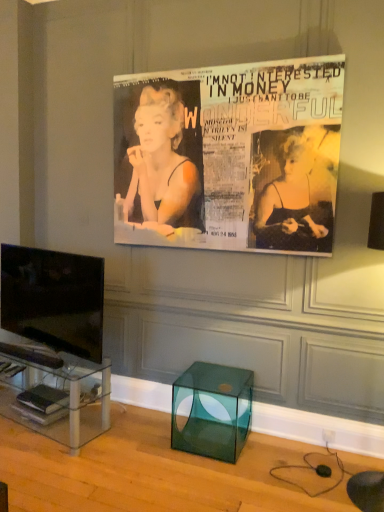
What do you see at coordinates (40, 413) in the screenshot? This screenshot has width=384, height=512. I see `hardcover book at lower left, arranged as the 3th magazine when viewed from the top` at bounding box center [40, 413].

Locate an element on the screen. The width and height of the screenshot is (384, 512). transparent glass cube at lower center is located at coordinates (212, 410).

What do you see at coordinates (59, 389) in the screenshot? I see `clear glass tv stand at lower left` at bounding box center [59, 389].

I want to click on black glossy tv at left, so click(54, 298).

There is a transparent glass cube at lower center. Identify the location of the 1st magazine below it (from the image's perspective). (44, 399).

Can you tell me how much transparent glass cube at lower center and matte black magazine at lower left, which ranks as the second magazine in top-to-bottom order, differ in facing direction?

The angular difference between transparent glass cube at lower center and matte black magazine at lower left, which ranks as the second magazine in top-to-bottom order, is 13.6 degrees.

Does transparent glass cube at lower center appear on the right side of matte black magazine at lower left, placed as the 2th magazine when sorted from bottom to top?

Yes.

Between point (187, 448) and point (45, 390), which one is positioned behind?

The point (45, 390) is farther.

Are transparent glass cube at lower center and hardcover book at lower left, arranged as the 3th magazine when viewed from the top, beside each other?

transparent glass cube at lower center is not next to hardcover book at lower left, arranged as the 3th magazine when viewed from the top, and they're not touching.

Who is taller, transparent glass cube at lower center or hardcover book at lower left, arranged as the 3th magazine when viewed from the top?

transparent glass cube at lower center.

Can you confirm if transparent glass cube at lower center is wider than hardcover book at lower left, arranged as the 3th magazine when viewed from the top?

Yes.

Is transparent glass cube at lower center facing towards hardcover book at lower left, arranged as the 3th magazine when viewed from the top?

No, transparent glass cube at lower center is not oriented towards hardcover book at lower left, arranged as the 3th magazine when viewed from the top.

Between hardcover book at lower left, arranged as the 3th magazine when viewed from the top, and black glossy tv at left, which one is positioned behind?

hardcover book at lower left, arranged as the 3th magazine when viewed from the top, is behind.

Looking at their sizes, would you say hardcover book at lower left, marked as the first magazine in a bottom-to-top arrangement, is wider or thinner than black glossy tv at left?

Considering their sizes, hardcover book at lower left, marked as the first magazine in a bottom-to-top arrangement, looks broader than black glossy tv at left.

Considering the positions of point (33, 414) and point (77, 291), is point (33, 414) closer or farther from the camera than point (77, 291)?

Point (33, 414) is farther from the camera than point (77, 291).

From the image's perspective, is hardcover book at lower left, arranged as the 3th magazine when viewed from the top, beneath black glossy tv at left?

Correct, hardcover book at lower left, arranged as the 3th magazine when viewed from the top, appears lower than black glossy tv at left in the image.

Is black glossy tv at left closer to the viewer compared to matte black magazine at lower left, placed as the 2th magazine when sorted from bottom to top?

Yes, it is in front of matte black magazine at lower left, placed as the 2th magazine when sorted from bottom to top.

The image size is (384, 512). What are the coordinates of `television located on the right of matte black magazine at lower left, which ranks as the second magazine in top-to-bottom order` in the screenshot? It's located at (54, 298).

Would you consider black glossy tv at left to be distant from matte black magazine at lower left, which ranks as the second magazine in top-to-bottom order?

black glossy tv at left is near matte black magazine at lower left, which ranks as the second magazine in top-to-bottom order, not far away.

Between black glossy tv at left and matte black magazine at lower left, which ranks as the second magazine in top-to-bottom order, which one has larger size?

With larger size is black glossy tv at left.

Is matte black poster at upper center at the back of matte black magazine at lower left, placed as the 2th magazine when sorted from bottom to top?

No, matte black poster at upper center is not at the back of matte black magazine at lower left, placed as the 2th magazine when sorted from bottom to top.

Considering the positions of objects matte black magazine at lower left, which ranks as the second magazine in top-to-bottom order, and matte black poster at upper center in the image provided, who is more to the left, matte black magazine at lower left, which ranks as the second magazine in top-to-bottom order, or matte black poster at upper center?

Positioned to the left is matte black magazine at lower left, which ranks as the second magazine in top-to-bottom order.

Which is correct: matte black magazine at lower left, placed as the 2th magazine when sorted from bottom to top, is inside matte black poster at upper center, or outside of it?

matte black magazine at lower left, placed as the 2th magazine when sorted from bottom to top, exists outside the volume of matte black poster at upper center.

Considering the relative sizes of clear glass tv stand at lower left and black glossy tv at left in the image provided, is clear glass tv stand at lower left wider than black glossy tv at left?

Yes, clear glass tv stand at lower left is wider than black glossy tv at left.

Is clear glass tv stand at lower left in front of black glossy tv at left?

That is False.

Is clear glass tv stand at lower left not close to black glossy tv at left?

clear glass tv stand at lower left is near black glossy tv at left, not far away.

From the image's perspective, relative to matte black poster at upper center, is hardcover book at lower left, marked as the first magazine in a bottom-to-top arrangement, above or below?

From the image's perspective, hardcover book at lower left, marked as the first magazine in a bottom-to-top arrangement, appears below matte black poster at upper center.

Looking at their sizes, would you say hardcover book at lower left, marked as the first magazine in a bottom-to-top arrangement, is wider or thinner than matte black poster at upper center?

hardcover book at lower left, marked as the first magazine in a bottom-to-top arrangement, is wider than matte black poster at upper center.

Is hardcover book at lower left, arranged as the 3th magazine when viewed from the top, to the left or to the right of matte black poster at upper center in the image?

hardcover book at lower left, arranged as the 3th magazine when viewed from the top, is to the left of matte black poster at upper center.

Considering the sizes of hardcover book at lower left, arranged as the 3th magazine when viewed from the top, and matte black poster at upper center in the image, is hardcover book at lower left, arranged as the 3th magazine when viewed from the top, taller or shorter than matte black poster at upper center?

Clearly, hardcover book at lower left, arranged as the 3th magazine when viewed from the top, is shorter compared to matte black poster at upper center.

Locate an element on the screen. This screenshot has height=512, width=384. glass box on the right of matte black magazine at lower left, which ranks as the second magazine in top-to-bottom order is located at coordinates (212, 410).

Identify the location of magazine that is the 2nd object located below the transparent glass cube at lower center (from the image's perspective). (40, 413).

Based on their spatial positions, is black glossy tv at left or clear glass tv stand at lower left further from transparent glass cube at lower center?

black glossy tv at left is further to transparent glass cube at lower center.

From the image, which object appears to be farther from transparent glass cube at lower center, black glossy tv at left or matte black magazine at lower left, which ranks as the second magazine in top-to-bottom order?

matte black magazine at lower left, which ranks as the second magazine in top-to-bottom order, is further to transparent glass cube at lower center.

Estimate the real-world distances between objects in this image. Which object is further from matte black poster at upper center, clear glass tv stand at lower left or transparent glass cube at lower center?

clear glass tv stand at lower left.

Which object lies nearer to the anchor point matte black magazine at lower left, acting as the 1th magazine starting from the top, clear glass tv stand at lower left or hardcover book at lower left, arranged as the 3th magazine when viewed from the top?

The object closer to matte black magazine at lower left, acting as the 1th magazine starting from the top, is clear glass tv stand at lower left.

From the image, which object appears to be farther from transparent glass cube at lower center, matte black magazine at lower left, which ranks as the second magazine in top-to-bottom order, or matte black poster at upper center?

matte black poster at upper center lies further to transparent glass cube at lower center than the other object.

Which object lies further to the anchor point matte black magazine at lower left, positioned as the third magazine in bottom-to-top order, black glossy tv at left or hardcover book at lower left, arranged as the 3th magazine when viewed from the top?

hardcover book at lower left, arranged as the 3th magazine when viewed from the top.

Looking at the image, which one is located further to transparent glass cube at lower center, hardcover book at lower left, marked as the first magazine in a bottom-to-top arrangement, or matte black poster at upper center?

Based on the image, matte black poster at upper center appears to be further to transparent glass cube at lower center.

Looking at the image, which one is located closer to matte black magazine at lower left, acting as the 1th magazine starting from the top, black glossy tv at left or matte black poster at upper center?

Among the two, black glossy tv at left is located nearer to matte black magazine at lower left, acting as the 1th magazine starting from the top.

The image size is (384, 512). What are the coordinates of `furniture between black glossy tv at left and hardcover book at lower left, arranged as the 3th magazine when viewed from the top, in the up-down direction` in the screenshot? It's located at (59, 389).

Identify the location of television located between matte black magazine at lower left, acting as the 1th magazine starting from the top, and transparent glass cube at lower center in the left-right direction. Image resolution: width=384 pixels, height=512 pixels. (54, 298).

Find the location of a particular element. The height and width of the screenshot is (512, 384). television between clear glass tv stand at lower left and transparent glass cube at lower center from left to right is located at coordinates (54, 298).

Locate an element on the screen. furniture between matte black poster at upper center and transparent glass cube at lower center in the vertical direction is located at coordinates (59, 389).